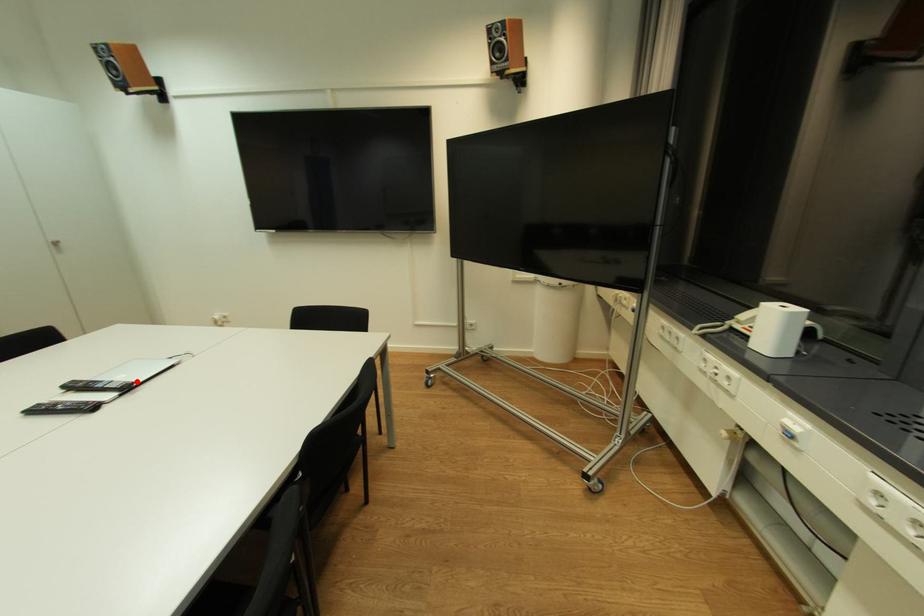
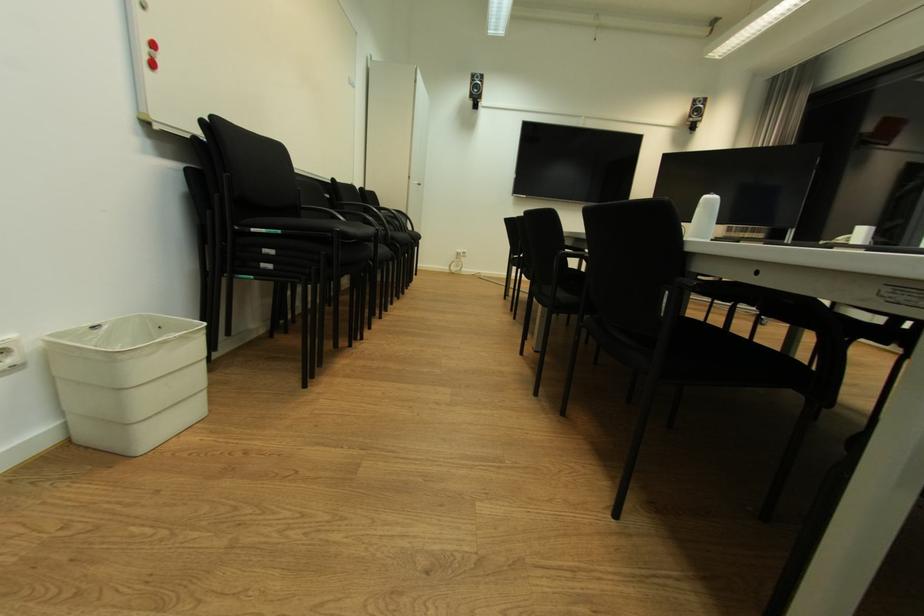
Question: I am providing you with two images of the same scene from different viewpoints. A red point is marked on the first image. At the location where the point appears in image 1, is it still visible in image 2?

Choices:
 (A) Yes
 (B) No

Answer: (B)